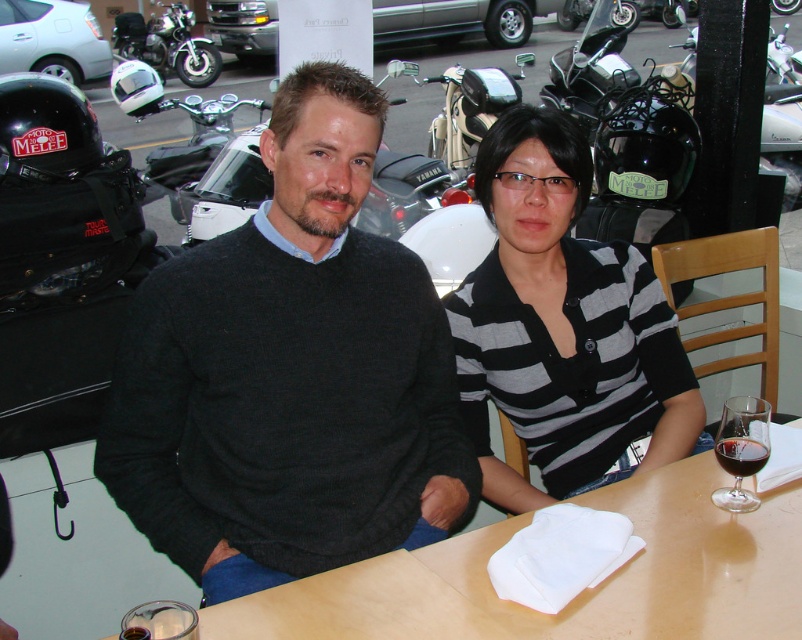
Question: Which object appears closest to the camera in this image?

Choices:
 (A) shiny black motorcycle at upper right
 (B) black striped shirt at center

Answer: (B)

Question: Can you confirm if beige leather scooter at center is bigger than black metallic motorcycle at upper left?

Choices:
 (A) no
 (B) yes

Answer: (A)

Question: Which object is closer to the camera taking this photo?

Choices:
 (A) black metallic motorcycle at upper left
 (B) beige leather scooter at center
 (C) translucent glass at table center
 (D) red glass at table right

Answer: (C)

Question: Can you confirm if black striped shirt at center is positioned to the right of translucent glass at table center?

Choices:
 (A) yes
 (B) no

Answer: (A)

Question: Which of these objects is positioned farthest from the black metallic motorcycle at upper left?

Choices:
 (A) beige leather scooter at center
 (B) dark gray sweater at center
 (C) black striped shirt at center

Answer: (B)

Question: In this image, where is beige leather scooter at center located relative to shiny black motorcycle at upper right?

Choices:
 (A) below
 (B) above

Answer: (A)